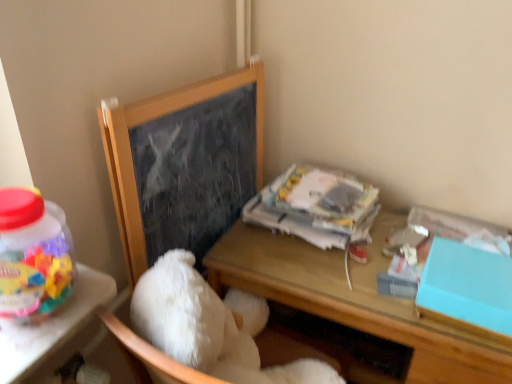
Identify the location of vacant area that is in front of white paper at upper right. (320, 274).